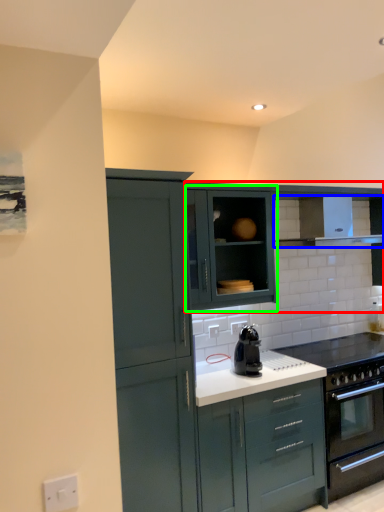
Question: Considering the real-world distances, which object is farthest from cabinetry (highlighted by a red box)? exhaust hood (highlighted by a blue box) or cabinetry (highlighted by a green box)?

Choices:
 (A) exhaust hood
 (B) cabinetry

Answer: (A)